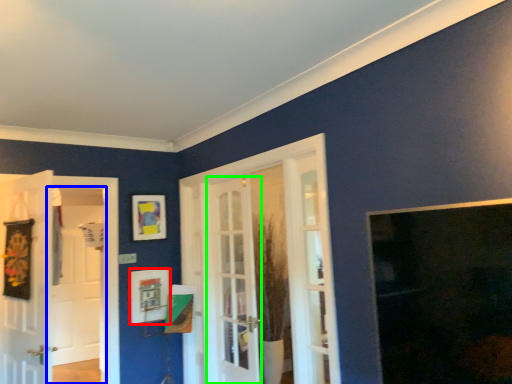
Question: Which is farther away from picture frame (highlighted by a red box)? screen door (highlighted by a blue box) or door (highlighted by a green box)?

Choices:
 (A) screen door
 (B) door

Answer: (A)